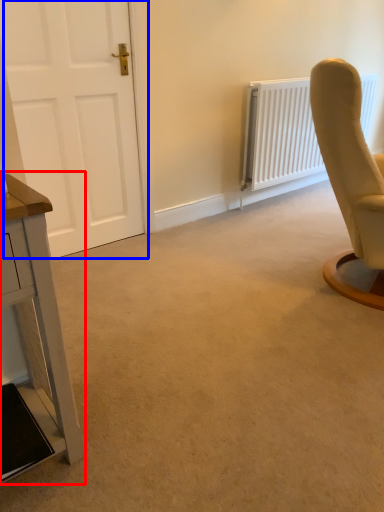
Question: Which object appears farthest to the camera in this image, table (highlighted by a red box) or door (highlighted by a blue box)?

Choices:
 (A) table
 (B) door

Answer: (B)